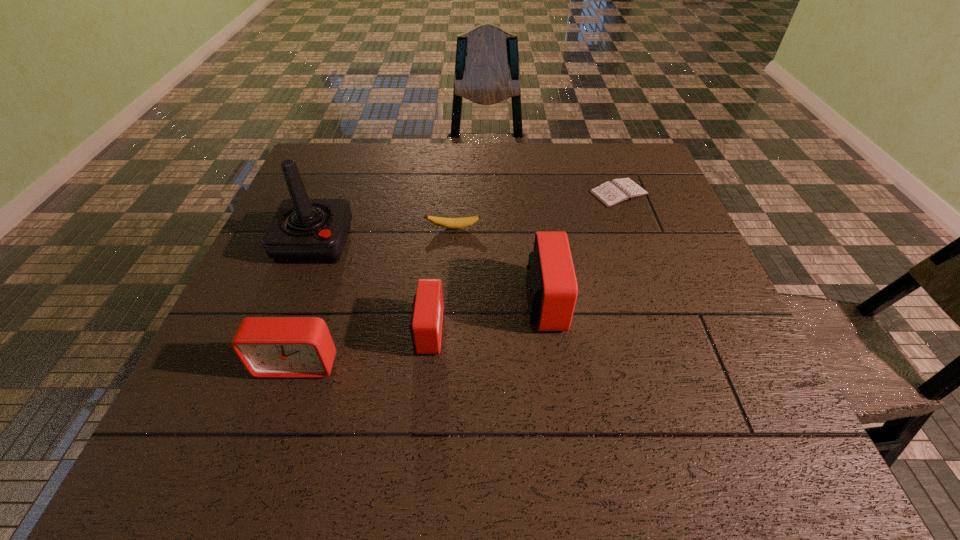
Find the location of a particular element. The width and height of the screenshot is (960, 540). the leftmost alarm clock is located at coordinates (269, 347).

You are a GUI agent. You are given a task and a screenshot of the screen. Output one action in this format:
    pyautogui.click(x=<x>, y=<y>)
    Task: Click on the third tallest object
    The image size is (960, 540).
    Given the screenshot: What is the action you would take?
    pyautogui.click(x=269, y=347)

Where is `the shortest alarm clock`? the shortest alarm clock is located at coordinates (426, 323).

Identify the location of the third shortest object. The image size is (960, 540). (426, 323).

Identify the location of the rightmost alarm clock. (551, 284).

Where is `the tallest object`? This screenshot has height=540, width=960. the tallest object is located at coordinates (303, 230).

Identify the location of the rightmost object. This screenshot has width=960, height=540. (617, 191).

Where is `the shortest object`? The width and height of the screenshot is (960, 540). the shortest object is located at coordinates (617, 191).

Where is `banana`? The width and height of the screenshot is (960, 540). banana is located at coordinates (452, 223).

I want to click on vacant space situated 0.270m on the front-facing side of the second alarm clock from left to right, so click(575, 332).